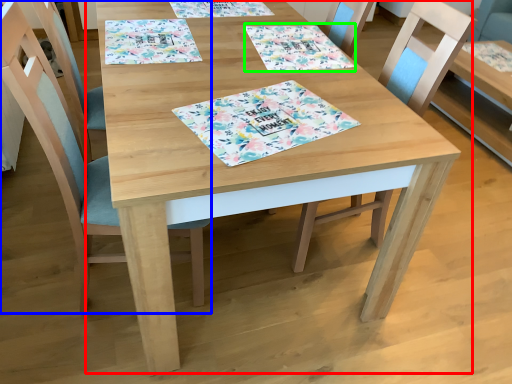
Question: Considering the real-world distances, which object is closest to table (highlighted by a red box)? chair (highlighted by a blue box) or tablecloth (highlighted by a green box).

Choices:
 (A) chair
 (B) tablecloth

Answer: (B)